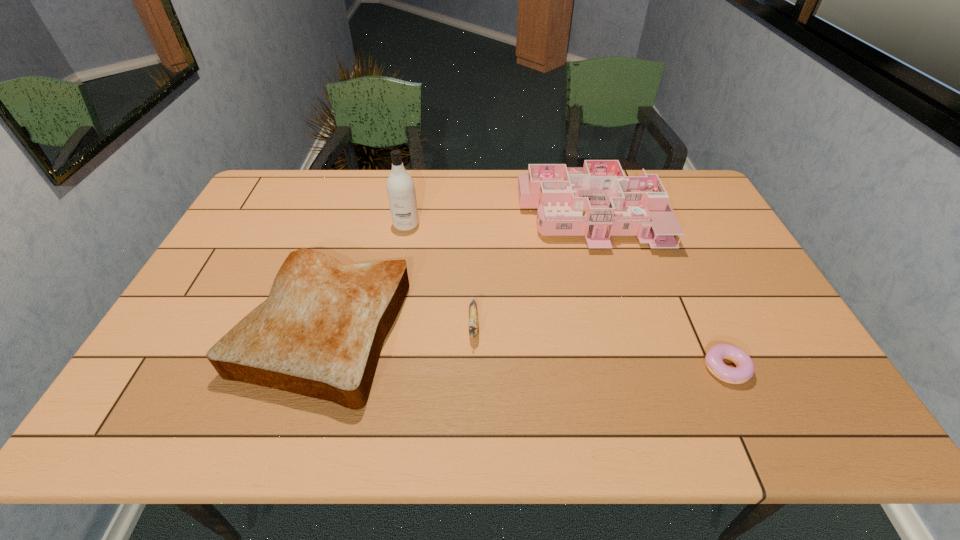
Find the location of `vacant space that satisfies the following two spatial constraints: 1. at the front entrance of the dollhouse; 2. on the left side of the doughnut`. vacant space that satisfies the following two spatial constraints: 1. at the front entrance of the dollhouse; 2. on the left side of the doughnut is located at coordinates (633, 368).

You are a GUI agent. You are given a task and a screenshot of the screen. Output one action in this format:
    pyautogui.click(x=<x>, y=<y>)
    Task: Click on the free space that satisfies the following two spatial constraints: 1. on the peel of the banana; 2. on the left side of the doughnut
    The image size is (960, 540).
    Given the screenshot: What is the action you would take?
    pyautogui.click(x=473, y=368)